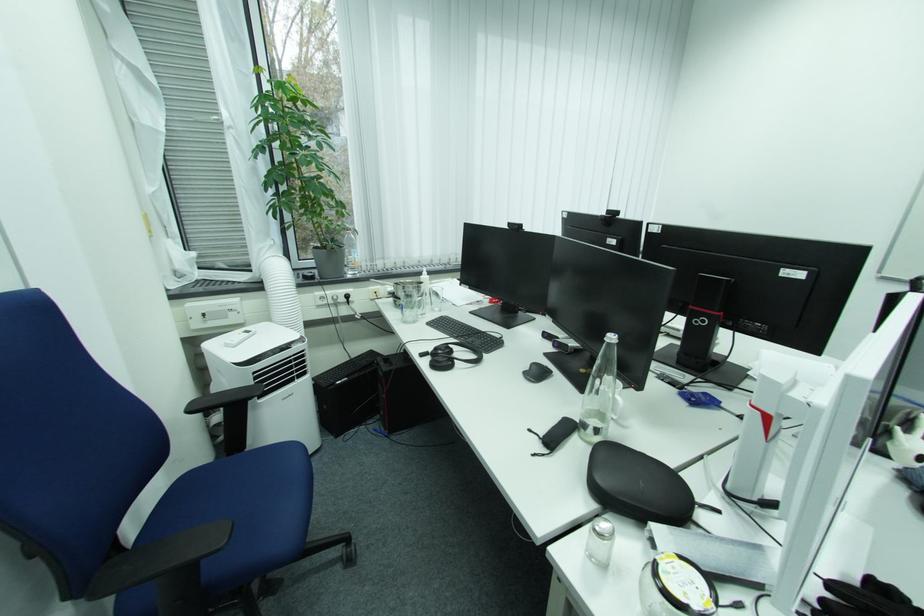
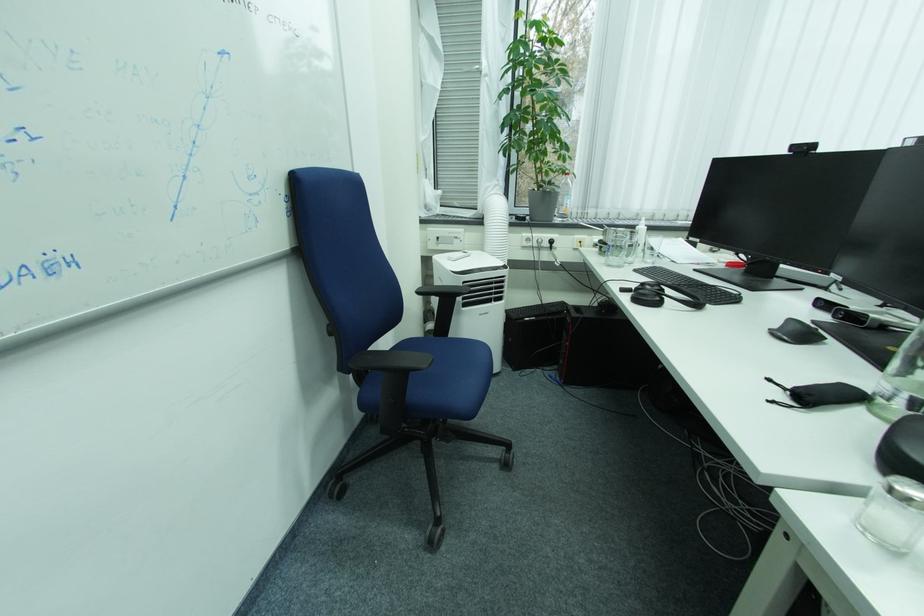
Find the pixel in the second image that matches point (536, 434) in the first image.

(773, 383)